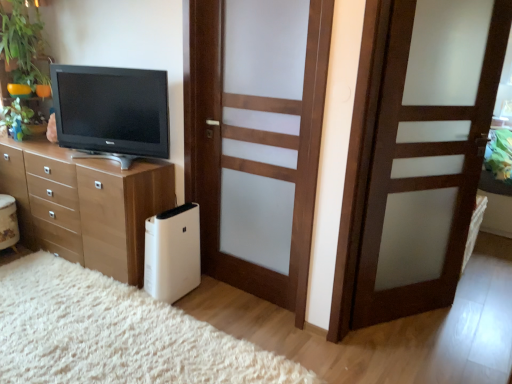
In order to face light wood chest of drawers at left, should I rotate leftwards or rightwards?

You should look left and rotate roughly 22.105 degrees.

Measure the distance between wooden door at center, acting as the first door starting from the right, and camera.

wooden door at center, acting as the first door starting from the right, is 1.90 meters from camera.

The height and width of the screenshot is (384, 512). Describe the element at coordinates (111, 112) in the screenshot. I see `matte black tv at left` at that location.

What do you see at coordinates (115, 334) in the screenshot? This screenshot has height=384, width=512. I see `white matte air purifier at lower left` at bounding box center [115, 334].

Locate an element on the screen. green glossy plant at upper left, placed as the 1th plant when sorted from bottom to top is located at coordinates [x=17, y=119].

The image size is (512, 384). In order to click on wooden door with frosted glass at center, marked as the 2th door in a right-to-left arrangement in this screenshot , I will do `click(256, 138)`.

I want to click on light wood chest of drawers at left, so click(85, 205).

Looking at this image, is wooden door with frosted glass at center, marked as the first door in a left-to-right arrangement, bigger or smaller than light wood chest of drawers at left?

Clearly, wooden door with frosted glass at center, marked as the first door in a left-to-right arrangement, is smaller in size than light wood chest of drawers at left.

Is wooden door with frosted glass at center, marked as the 2th door in a right-to-left arrangement, positioned far away from light wood chest of drawers at left?

wooden door with frosted glass at center, marked as the 2th door in a right-to-left arrangement, is near light wood chest of drawers at left, not far away.

Which point is more forward, (x=274, y=159) or (x=40, y=149)?

The point (x=274, y=159) is closer to the camera.

Based on the photo, from the image's perspective, does wooden door with frosted glass at center, marked as the 2th door in a right-to-left arrangement, appear higher than light wood chest of drawers at left?

Yes, from the image's perspective, wooden door with frosted glass at center, marked as the 2th door in a right-to-left arrangement, is over light wood chest of drawers at left.

Which of these two, matte black tv at left or white matte air purifier at lower left, is smaller?

Smaller between the two is matte black tv at left.

From the image's perspective, which is above, matte black tv at left or white matte air purifier at lower left?

matte black tv at left appears higher in the image.

From a real-world perspective, is matte black tv at left above or below white matte air purifier at lower left?

From a real-world perspective, matte black tv at left is physically above white matte air purifier at lower left.

Between matte black tv at left and white matte air purifier at lower left, which one has more height?

Standing taller between the two is matte black tv at left.

From a real-world perspective, is light wood chest of drawers at left positioned under white matte air purifier at lower left based on gravity?

Actually, light wood chest of drawers at left is physically above white matte air purifier at lower left in the real world.

Based on their sizes in the image, would you say light wood chest of drawers at left is bigger or smaller than white matte air purifier at lower left?

Clearly, light wood chest of drawers at left is larger in size than white matte air purifier at lower left.

Looking at this image, are light wood chest of drawers at left and white matte air purifier at lower left located far from each other?

They are positioned close to each other.

In the image, is light wood chest of drawers at left on the left side or the right side of white matte air purifier at lower left?

From the image, it's evident that light wood chest of drawers at left is to the left of white matte air purifier at lower left.

From the image's perspective, does white plastic air purifier at lower center appear lower than green leafy plant at upper left, the second plant in the bottom-to-top sequence?

Yes, from the image's perspective, white plastic air purifier at lower center is below green leafy plant at upper left, the second plant in the bottom-to-top sequence.

Is white plastic air purifier at lower center positioned beyond the bounds of green leafy plant at upper left, the second plant in the bottom-to-top sequence?

white plastic air purifier at lower center lies outside green leafy plant at upper left, the second plant in the bottom-to-top sequence,'s area.

Between white plastic air purifier at lower center and green leafy plant at upper left, acting as the first plant starting from the top, which one has smaller size?

With smaller size is green leafy plant at upper left, acting as the first plant starting from the top.

Considering the positions of objects white plastic air purifier at lower center and green leafy plant at upper left, acting as the first plant starting from the top, in the image provided, who is behind, white plastic air purifier at lower center or green leafy plant at upper left, acting as the first plant starting from the top,?

green leafy plant at upper left, acting as the first plant starting from the top, is behind.

From the image's perspective, is white plastic air purifier at lower center on white matte air purifier at lower left?

Indeed, from the image's perspective, white plastic air purifier at lower center is shown above white matte air purifier at lower left.

Is white plastic air purifier at lower center inside or outside of white matte air purifier at lower left?

white plastic air purifier at lower center is spatially situated outside white matte air purifier at lower left.

The image size is (512, 384). I want to click on plain below the white plastic air purifier at lower center (from the image's perspective), so click(115, 334).

Which object is closer to the camera taking this photo, white matte air purifier at lower left or green leafy plant at upper left, acting as the first plant starting from the top?

Positioned in front is white matte air purifier at lower left.

Can you confirm if white matte air purifier at lower left is positioned to the left of green leafy plant at upper left, acting as the first plant starting from the top?

Incorrect, white matte air purifier at lower left is not on the left side of green leafy plant at upper left, acting as the first plant starting from the top.

What's the angular difference between white matte air purifier at lower left and green leafy plant at upper left, the second plant in the bottom-to-top sequence,'s facing directions?

There is a 85.6-degree angle between the facing directions of white matte air purifier at lower left and green leafy plant at upper left, the second plant in the bottom-to-top sequence.

Is white matte air purifier at lower left smaller than green leafy plant at upper left, acting as the first plant starting from the top?

Actually, white matte air purifier at lower left might be larger than green leafy plant at upper left, acting as the first plant starting from the top.

Is wooden door at center, acting as the first door starting from the right, wider than white matte air purifier at lower left?

No.

Would you say wooden door at center, acting as the first door starting from the right, is inside or outside white matte air purifier at lower left?

wooden door at center, acting as the first door starting from the right, is spatially situated outside white matte air purifier at lower left.

Considering the sizes of objects wooden door at center, the 2th door when ordered from left to right, and white matte air purifier at lower left in the image provided, who is shorter, wooden door at center, the 2th door when ordered from left to right, or white matte air purifier at lower left?

white matte air purifier at lower left.

You are a GUI agent. You are given a task and a screenshot of the screen. Output one action in this format:
    pyautogui.click(x=<x>, y=<y>)
    Task: Click on the chest of drawers located underneath the wooden door with frosted glass at center, marked as the 2th door in a right-to-left arrangement (from a real-world perspective)
    The width and height of the screenshot is (512, 384).
    Given the screenshot: What is the action you would take?
    pyautogui.click(x=85, y=205)

Find the location of `television above the white matte air purifier at lower left (from the image's perspective)`. television above the white matte air purifier at lower left (from the image's perspective) is located at coordinates (111, 112).

Estimate the real-world distances between objects in this image. Which object is closer to wooden door at center, acting as the first door starting from the right, white plastic air purifier at lower center or wooden door with frosted glass at center, marked as the 2th door in a right-to-left arrangement?

wooden door with frosted glass at center, marked as the 2th door in a right-to-left arrangement, is positioned closer to the anchor wooden door at center, acting as the first door starting from the right.

Estimate the real-world distances between objects in this image. Which object is further from wooden door with frosted glass at center, marked as the first door in a left-to-right arrangement, white plastic air purifier at lower center or white matte air purifier at lower left?

white matte air purifier at lower left.

Estimate the real-world distances between objects in this image. Which object is further from green glossy plant at upper left, placed as the 1th plant when sorted from bottom to top, wooden door at center, acting as the first door starting from the right, or wooden door with frosted glass at center, marked as the first door in a left-to-right arrangement?

wooden door at center, acting as the first door starting from the right.

Estimate the real-world distances between objects in this image. Which object is closer to green glossy plant at upper left, the 2th plant in the top-to-bottom sequence, wooden door with frosted glass at center, marked as the first door in a left-to-right arrangement, or white matte air purifier at lower left?

white matte air purifier at lower left.

From the image, which object appears to be farther from white plastic air purifier at lower center, green glossy plant at upper left, placed as the 1th plant when sorted from bottom to top, or white matte air purifier at lower left?

green glossy plant at upper left, placed as the 1th plant when sorted from bottom to top, lies further to white plastic air purifier at lower center than the other object.

Based on the photo, from the image, which object appears to be farther from wooden door with frosted glass at center, marked as the first door in a left-to-right arrangement, light wood chest of drawers at left or green leafy plant at upper left, the second plant in the bottom-to-top sequence?

The object further to wooden door with frosted glass at center, marked as the first door in a left-to-right arrangement, is green leafy plant at upper left, the second plant in the bottom-to-top sequence.

From the picture: From the image, which object appears to be farther from white matte air purifier at lower left, wooden door at center, acting as the first door starting from the right, or white plastic air purifier at lower center?

wooden door at center, acting as the first door starting from the right, is further to white matte air purifier at lower left.

Estimate the real-world distances between objects in this image. Which object is further from white plastic air purifier at lower center, green leafy plant at upper left, the second plant in the bottom-to-top sequence, or wooden door at center, the 2th door when ordered from left to right?

Based on the image, green leafy plant at upper left, the second plant in the bottom-to-top sequence, appears to be further to white plastic air purifier at lower center.

The image size is (512, 384). I want to click on chest of drawers between matte black tv at left and white plastic air purifier at lower center in the up-down direction, so click(x=85, y=205).

Image resolution: width=512 pixels, height=384 pixels. Find the location of `appliance between white matte air purifier at lower left and wooden door at center, the 2th door when ordered from left to right, from left to right`. appliance between white matte air purifier at lower left and wooden door at center, the 2th door when ordered from left to right, from left to right is located at coordinates (172, 253).

You are a GUI agent. You are given a task and a screenshot of the screen. Output one action in this format:
    pyautogui.click(x=<x>, y=<y>)
    Task: Click on the door situated between light wood chest of drawers at left and wooden door at center, the 2th door when ordered from left to right, from left to right
    
    Given the screenshot: What is the action you would take?
    pyautogui.click(x=256, y=138)

Where is `door between green glossy plant at upper left, placed as the 1th plant when sorted from bottom to top, and wooden door at center, acting as the first door starting from the right, from left to right`? This screenshot has width=512, height=384. door between green glossy plant at upper left, placed as the 1th plant when sorted from bottom to top, and wooden door at center, acting as the first door starting from the right, from left to right is located at coordinates (256, 138).